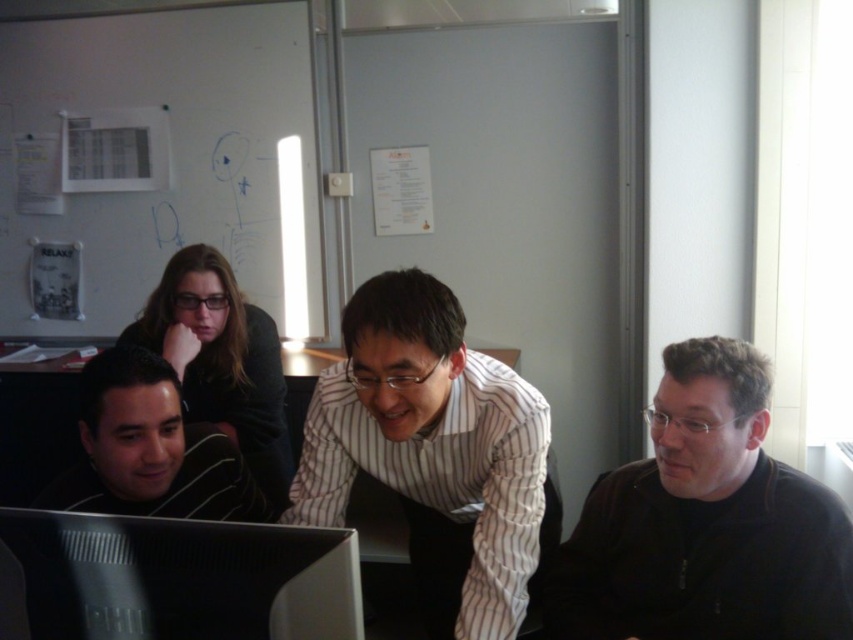
Question: Does white striped shirt at center come in front of matte black monitor at lower left?

Choices:
 (A) no
 (B) yes

Answer: (A)

Question: Is black matte jacket at lower right below matte black monitor at lower left?

Choices:
 (A) yes
 (B) no

Answer: (A)

Question: Observing the image, what is the correct spatial positioning of black matte jacket at lower right in reference to white striped shirt at center?

Choices:
 (A) left
 (B) right

Answer: (B)

Question: Which object is positioned farthest from the white striped shirt at center?

Choices:
 (A) black matte shirt at lower left
 (B) matte black monitor at lower left

Answer: (B)

Question: Which of these objects is positioned closest to the white striped shirt at center?

Choices:
 (A) black matte shirt at lower left
 (B) black matte jacket at lower right
 (C) matte black monitor at lower left

Answer: (B)

Question: Which point is farther from the camera taking this photo?

Choices:
 (A) (107, 435)
 (B) (213, 576)
 (C) (479, 477)
 (D) (677, 477)

Answer: (C)